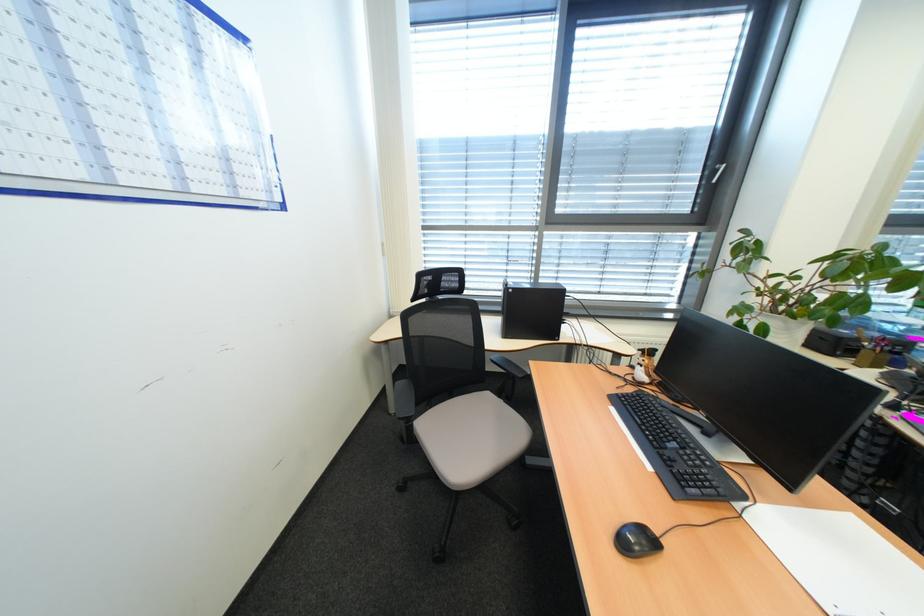
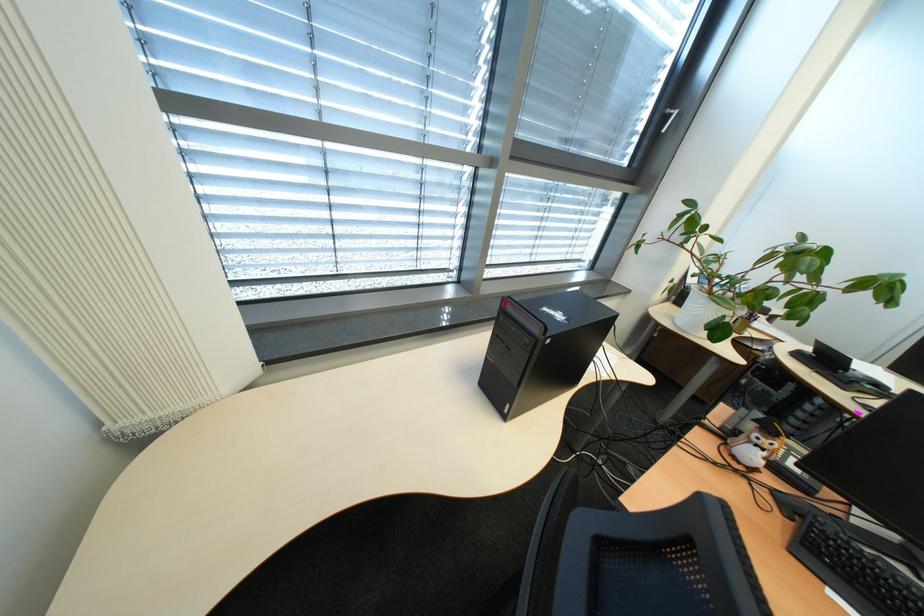
In the second image, find the point that corresponds to (727,166) in the first image.

(678, 110)